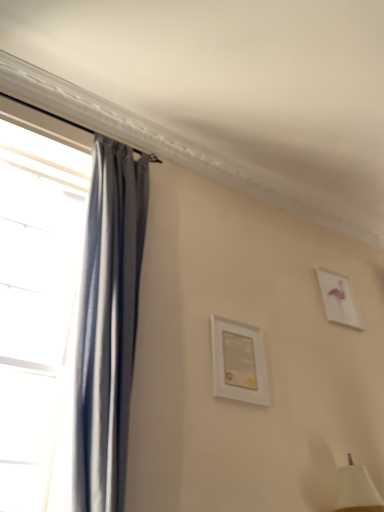
Question: Which direction should I rotate to look at white matte picture frame at center, the 2th picture frame when ordered from right to left?

Choices:
 (A) right
 (B) left

Answer: (A)

Question: Does white matte picture frame at center, marked as the first picture frame in a front-to-back arrangement, lie behind white glossy picture frame at upper right, the second picture frame in the front-to-back sequence?

Choices:
 (A) yes
 (B) no

Answer: (B)

Question: Is white matte picture frame at center, marked as the first picture frame in a front-to-back arrangement, in front of white glossy picture frame at upper right, marked as the first picture frame in a right-to-left arrangement?

Choices:
 (A) no
 (B) yes

Answer: (B)

Question: Is white matte picture frame at center, the first picture frame viewed from the left, bigger than white glossy picture frame at upper right, which ranks as the 2th picture frame in left-to-right order?

Choices:
 (A) no
 (B) yes

Answer: (A)

Question: From a real-world perspective, is white matte picture frame at center, the first picture frame viewed from the left, under white glossy picture frame at upper right, which ranks as the 2th picture frame in left-to-right order?

Choices:
 (A) yes
 (B) no

Answer: (A)

Question: Is white matte picture frame at center, the first picture frame viewed from the left, wider than white glossy picture frame at upper right, which ranks as the 2th picture frame in left-to-right order?

Choices:
 (A) no
 (B) yes

Answer: (B)

Question: From the image's perspective, is white matte picture frame at center, the 2th picture frame when ordered from right to left, on top of white glossy picture frame at upper right, which ranks as the 2th picture frame in left-to-right order?

Choices:
 (A) no
 (B) yes

Answer: (A)

Question: Considering the relative positions of white matte picture frame at center, the 2th picture frame when ordered from right to left, and matte gray curtain at left in the image provided, is white matte picture frame at center, the 2th picture frame when ordered from right to left, in front of matte gray curtain at left?

Choices:
 (A) no
 (B) yes

Answer: (A)

Question: Is white matte picture frame at center, which is the 2th picture frame in back-to-front order, placed right next to matte gray curtain at left?

Choices:
 (A) yes
 (B) no

Answer: (B)

Question: From a real-world perspective, is white matte picture frame at center, marked as the first picture frame in a front-to-back arrangement, physically above matte gray curtain at left?

Choices:
 (A) yes
 (B) no

Answer: (B)

Question: Is the position of white matte picture frame at center, which is the 2th picture frame in back-to-front order, more distant than that of matte gray curtain at left?

Choices:
 (A) no
 (B) yes

Answer: (B)

Question: Is white matte picture frame at center, which is the 2th picture frame in back-to-front order, taller than matte gray curtain at left?

Choices:
 (A) no
 (B) yes

Answer: (A)

Question: Does white matte picture frame at center, the 2th picture frame when ordered from right to left, have a lesser width compared to matte gray curtain at left?

Choices:
 (A) yes
 (B) no

Answer: (A)

Question: Is white glossy picture frame at upper right, the second picture frame in the front-to-back sequence, not within white matte picture frame at center, marked as the first picture frame in a front-to-back arrangement?

Choices:
 (A) yes
 (B) no

Answer: (A)